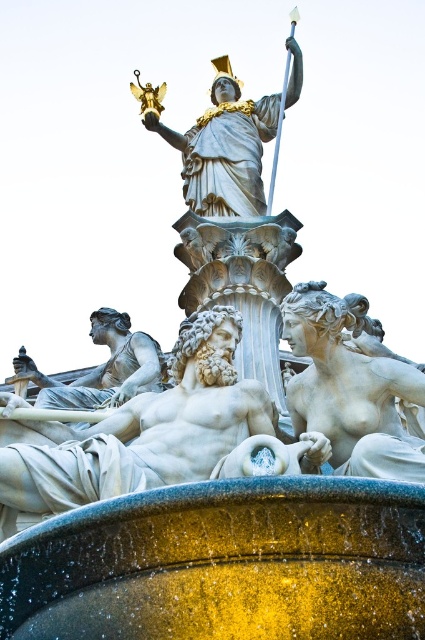
You are an art conservator assessing the space between two statues in the fountain. The statues are the smooth white statue at lower right and the white marble statue at lower left. If you need to place a protective barrier between them, which statue has a smaller width that might require a narrower barrier?

The smooth white statue at lower right has a smaller width than the white marble statue at lower left, so the barrier between them should be narrower near the smooth white statue at lower right.

You are an art conservator working on a large outdoor sculpture installation. You need to move a ladder from the polished bronze statue at center to the white marble statue at lower left. The ladder is 20 feet long. Will the ladder be long enough to reach between the two statues?

The distance between the polished bronze statue at center and the white marble statue at lower left is 73.31 feet. Since the ladder is only 20 feet long, it will not be long enough to span the distance between the two statues.

You are an art curator planning to display the polished bronze statue at center and the white marble statue at lower left in a new exhibition. Given their sizes, which statue should be placed first in the exhibition path to ensure visitors can easily view both without obstruction?

The polished bronze statue at center should be placed first since it is wider than the white marble statue at lower left, allowing visitors to see both statues without obstruction as the narrower statue can be positioned afterward in the path.